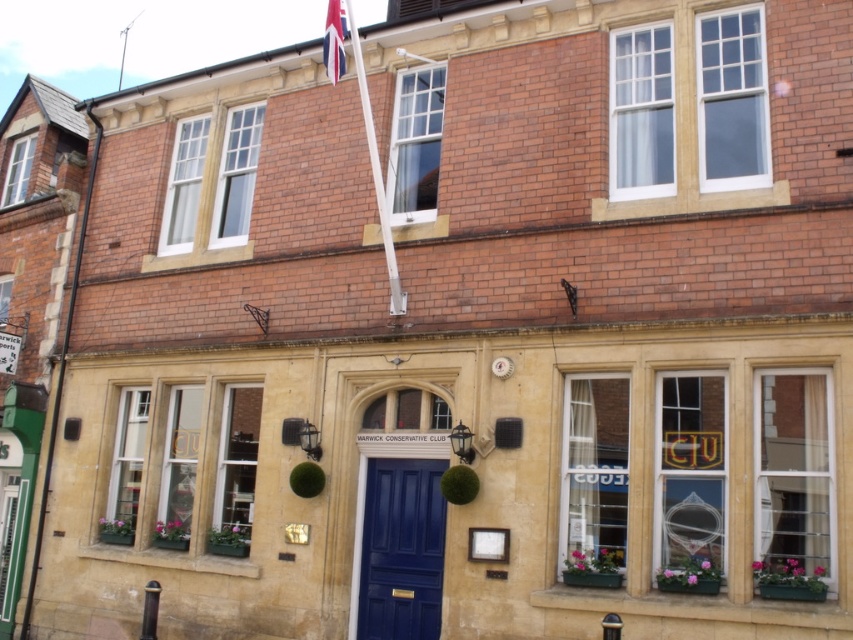
You are standing in front of the two story building and want to enter the Warwick Conservative Club. Which object should you approach first, the shiny blue door at center or the red fabric flag at upper center?

You should approach the shiny blue door at center first because it is the entrance to the Warwick Conservative Club, while the red fabric flag at upper center is located higher up and not an entry point.